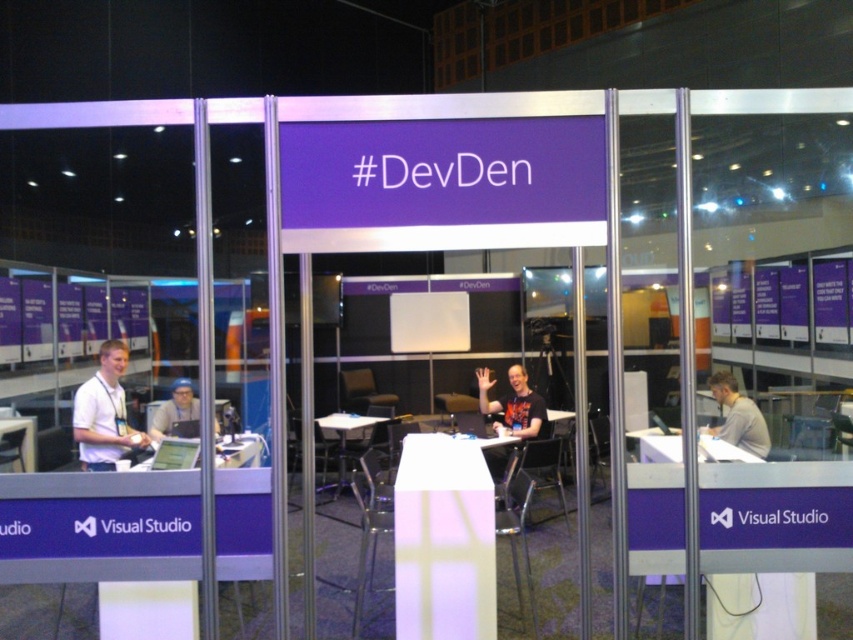
Can you confirm if white matte shirt at left is wider than white plastic table at center?

In fact, white matte shirt at left might be narrower than white plastic table at center.

Does white matte shirt at left appear on the left side of white plastic table at center?

Yes, white matte shirt at left is to the left of white plastic table at center.

This screenshot has width=853, height=640. What do you see at coordinates (103, 412) in the screenshot?
I see `white matte shirt at left` at bounding box center [103, 412].

The height and width of the screenshot is (640, 853). I want to click on white matte shirt at left, so click(103, 412).

Who is lower down, matte black laptop at left or white plastic table at lower left?

white plastic table at lower left is lower down.

What do you see at coordinates (173, 410) in the screenshot? This screenshot has width=853, height=640. I see `matte black laptop at left` at bounding box center [173, 410].

Describe the element at coordinates (173, 410) in the screenshot. I see `matte black laptop at left` at that location.

In order to click on matte black laptop at left in this screenshot , I will do `click(173, 410)`.

Find the location of a particular element. The width and height of the screenshot is (853, 640). gray matte shirt at right is located at coordinates (737, 417).

Measure the distance between gray matte shirt at right and white plastic table at center.

A distance of 11.61 feet exists between gray matte shirt at right and white plastic table at center.

Is point (746, 416) farther from camera compared to point (343, 444)?

No.

This screenshot has height=640, width=853. Identify the location of gray matte shirt at right. point(737,417).